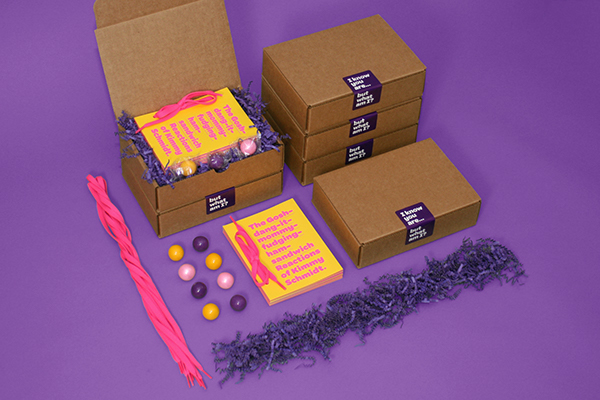
The width and height of the screenshot is (600, 400). Identify the location of paper decor. (377, 316).